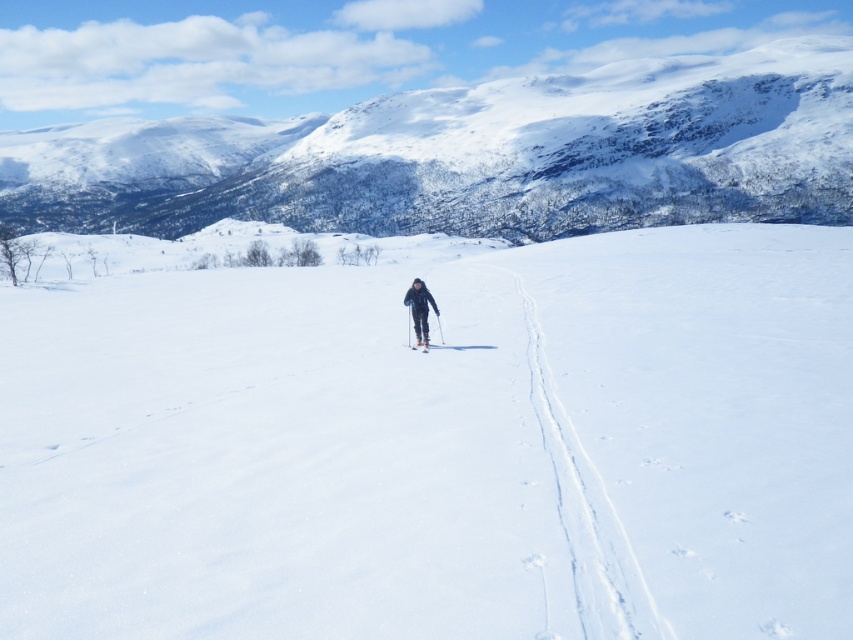
You are a photographer planning to capture a landscape photo of the snowy white mountain at upper center and the white matte ski at center. Which object should you focus on first if you want to include both in the frame without moving the camera?

You should focus on the snowy white mountain at upper center first because it is larger in size than the white matte ski at center, allowing it to be more prominent in the frame.

You are a photographer planning to take a photo of the white snow ski slope at center and the black matte ski suit at center. Based on their positions, which object will appear closer to the camera in the final photo?

The white snow ski slope at center is in front of the black matte ski suit at center, so it will appear closer to the camera in the final photo.